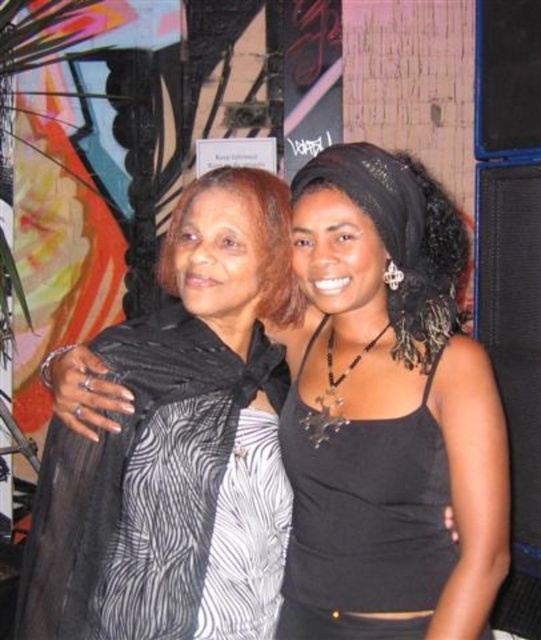
Is black matte tank top at center shorter than matte black scarf at center?

No, black matte tank top at center is not shorter than matte black scarf at center.

Does point (348, 304) come behind point (270, 244)?

No, it is not.

Is point (404, 540) positioned in front of point (174, 285)?

That is True.

This screenshot has width=541, height=640. Find the location of `black matte tank top at center`. black matte tank top at center is located at coordinates (390, 412).